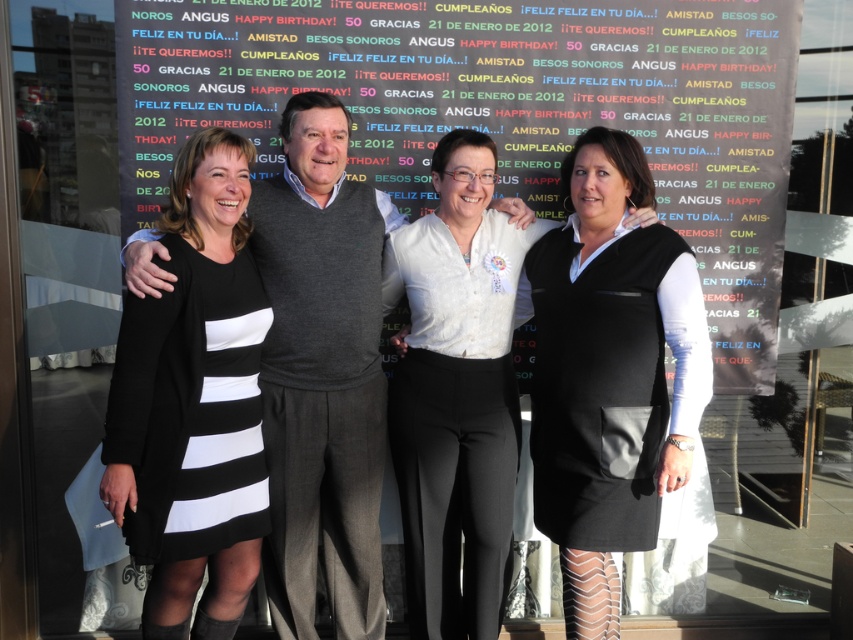
Between multicolored fabric banner at center and white textured blouse at center, which one has less height?

With less height is multicolored fabric banner at center.

Which is more to the left, multicolored fabric banner at center or white textured blouse at center?

From the viewer's perspective, white textured blouse at center appears more on the left side.

This screenshot has width=853, height=640. Identify the location of multicolored fabric banner at center. (515, 112).

Identify the location of multicolored fabric banner at center. [515, 112].

Based on the photo, does dark gray sweater at center have a lesser height compared to white textured blouse at center?

No.

Is dark gray sweater at center bigger than white textured blouse at center?

No.

Locate an element on the screen. dark gray sweater at center is located at coordinates (321, 380).

Which is more to the left, matte black dress at center or white textured blouse at center?

Positioned to the left is white textured blouse at center.

The width and height of the screenshot is (853, 640). Describe the element at coordinates (604, 374) in the screenshot. I see `matte black dress at center` at that location.

Who is more distant from viewer, (x=592, y=372) or (x=424, y=593)?

The point (x=424, y=593) is behind.

Locate an element on the screen. This screenshot has width=853, height=640. matte black dress at center is located at coordinates (604, 374).